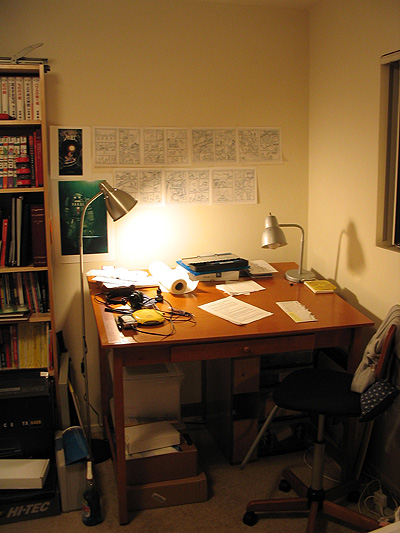
Where is `roll of paper towels on desk`? roll of paper towels on desk is located at coordinates (171, 274).